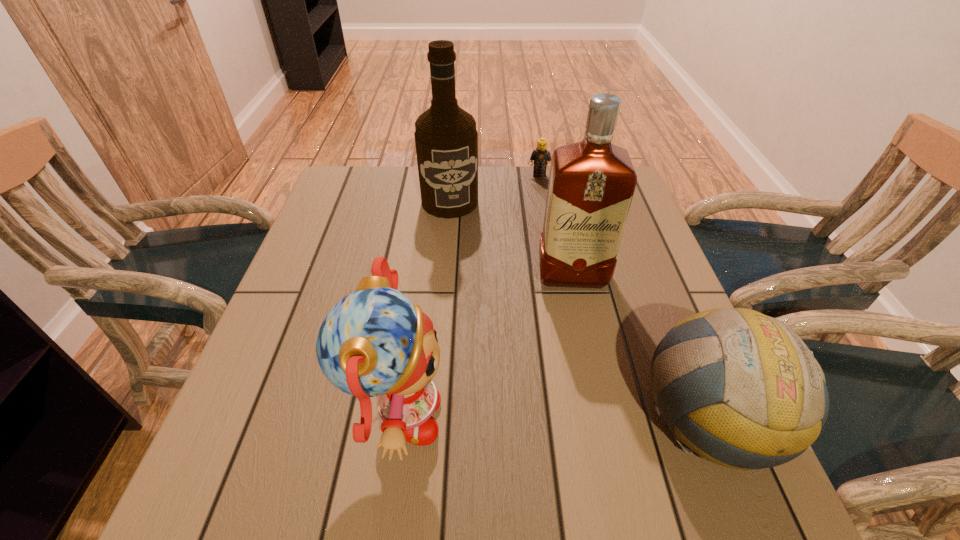
At what (x,y) coordinates should I click in order to perform the action: click on vacant space located 0.150m in front of the shortest object. Please return your answer as a coordinate pair (x, y). Looking at the image, I should click on (539, 205).

The height and width of the screenshot is (540, 960). Identify the location of vacant position located on the label of the alcohol. (470, 278).

Image resolution: width=960 pixels, height=540 pixels. Identify the location of blank space located 0.390m on the label of the alcohol. (484, 327).

This screenshot has width=960, height=540. I want to click on free location located 0.210m on the label of the alcohol, so click(468, 269).

Locate an element on the screen. Image resolution: width=960 pixels, height=540 pixels. free spot located on the front label of the third farthest object is located at coordinates (584, 370).

Identify the location of vacant space located 0.060m on the front label of the third farthest object. This screenshot has height=540, width=960. coord(576,312).

Identify the location of vacant space located on the front label of the third farthest object. The height and width of the screenshot is (540, 960). (584, 366).

Image resolution: width=960 pixels, height=540 pixels. In order to click on Lego present at the far edge in this screenshot , I will do `click(541, 155)`.

Locate an element on the screen. alcohol situated at the far edge is located at coordinates (446, 139).

Locate an element on the screen. The image size is (960, 540). doll located in the near edge section of the desktop is located at coordinates (374, 342).